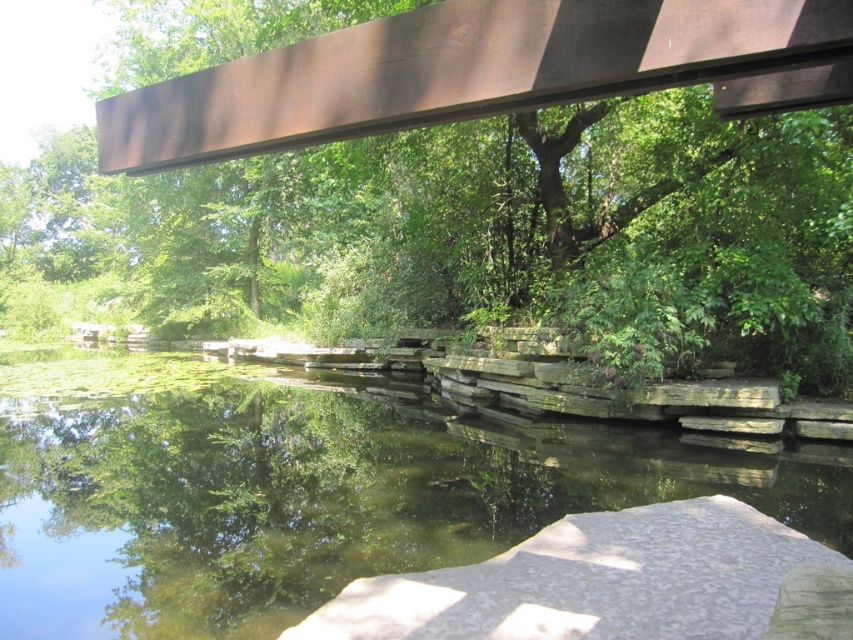
Question: Can you confirm if rusty metal beam at upper center is positioned to the left of gray/granite rock at lower center?

Choices:
 (A) yes
 (B) no

Answer: (A)

Question: Which of the following is the farthest from the observer?

Choices:
 (A) rusty metal beam at upper center
 (B) gray/granite rock at lower center

Answer: (B)

Question: In this image, where is greenish stone river at center located relative to gray/granite rock at lower center?

Choices:
 (A) below
 (B) above

Answer: (A)

Question: Based on their relative distances, which object is nearer to the rusty metal beam at upper center?

Choices:
 (A) greenish stone river at center
 (B) gray/granite rock at lower center

Answer: (A)

Question: Which point is farther to the camera?

Choices:
 (A) (543, 502)
 (B) (343, 16)

Answer: (B)

Question: Is rusty metal beam at upper center smaller than gray/granite rock at lower center?

Choices:
 (A) yes
 (B) no

Answer: (B)